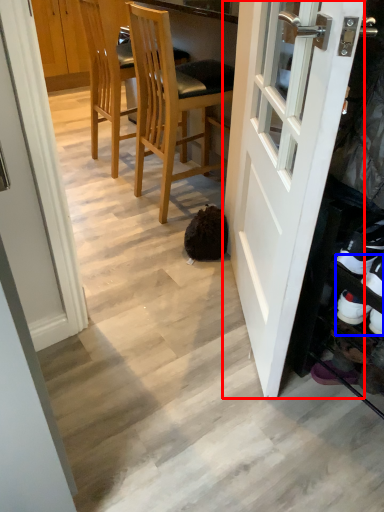
Question: Which object appears closest to the camera in this image, door (highlighted by a red box) or shoe (highlighted by a blue box)?

Choices:
 (A) door
 (B) shoe

Answer: (A)